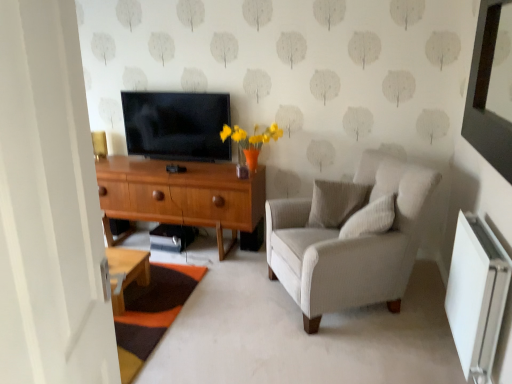
The width and height of the screenshot is (512, 384). What are the coordinates of `vacant region to the left of light gray fabric armchair at right` in the screenshot? It's located at (231, 307).